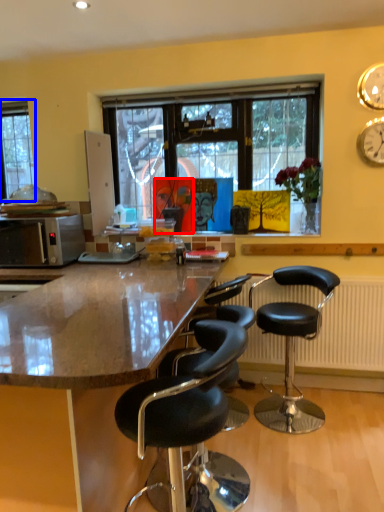
Question: Which of the following is the farthest to the observer, person (highlighted by a red box) or window (highlighted by a blue box)?

Choices:
 (A) person
 (B) window

Answer: (B)